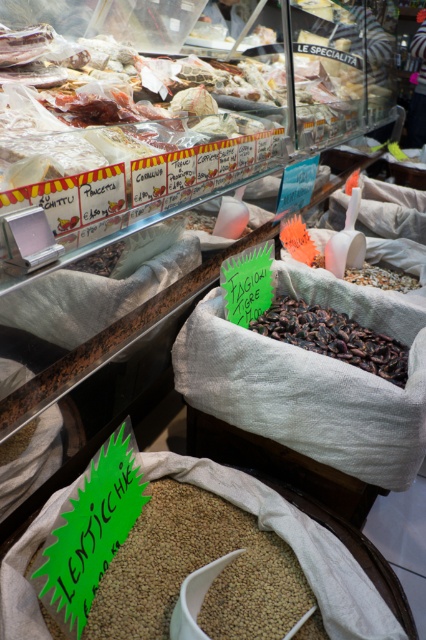
You are a customer at an Italian market and see two sacks in the foreground. The sacks are labeled with green tags. One contains brown matte lentils at center and the other has dark brown grain at center. Which sack has the larger grains?

The dark brown grain at center is larger than the brown matte lentils at center, so the sack with dark brown grain at center contains the larger grains.

You are a customer at an Italian market and see two sacks in the foreground. One contains brown matte lentils at center and the other holds dark brown grain at center. Which sack is positioned to the left?

The brown matte lentils at center are to the left of the dark brown grain at center, so the sack with brown matte lentils at center is positioned to the left.